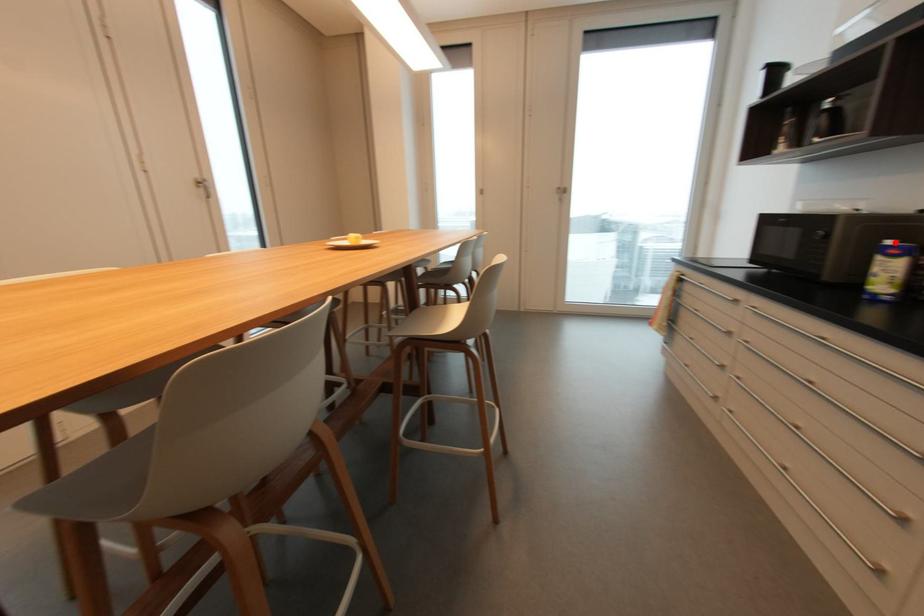
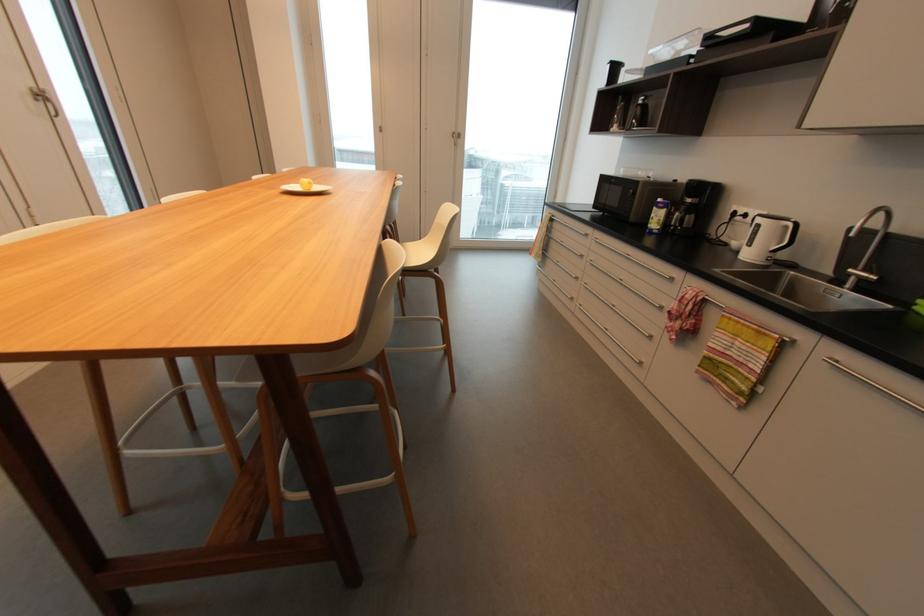
Question: I am providing you with two images of the same scene from different viewpoints. A red point is shown in image1. For the corresponding object point in image2, is it positioned nearer or farther from the camera?

Choices:
 (A) Nearer
 (B) Farther

Answer: (A)